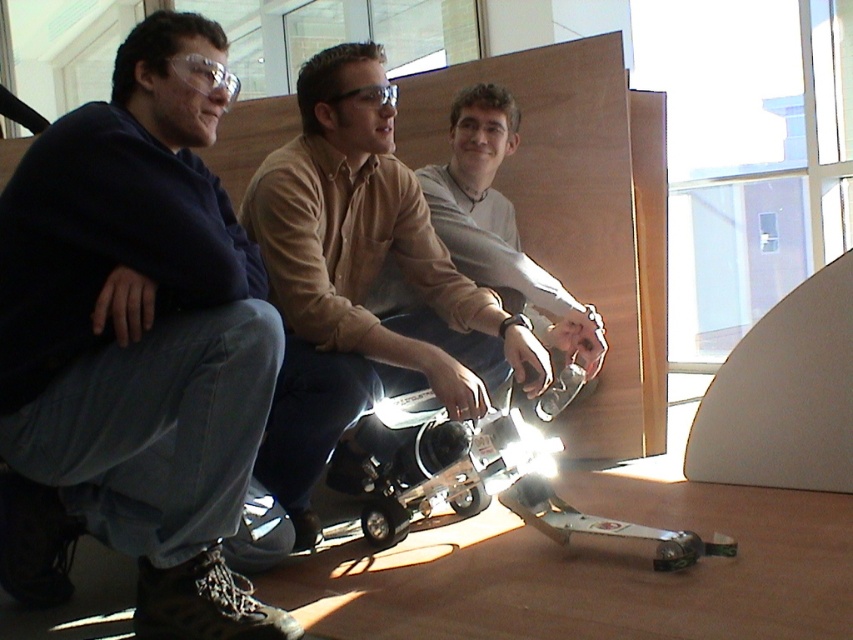
Is matte brown shirt at center shorter than metallic silver drone at center?

In fact, matte brown shirt at center may be taller than metallic silver drone at center.

Is matte brown shirt at center positioned in front of metallic silver drone at center?

No, matte brown shirt at center is further to the viewer.

Where is `matte brown shirt at center`? matte brown shirt at center is located at coordinates (361, 280).

Is metallic silver drone at center behind light gray shirt at center?

No.

Does metallic silver drone at center have a greater width compared to light gray shirt at center?

Indeed, metallic silver drone at center has a greater width compared to light gray shirt at center.

Is point (495, 396) positioned behind point (486, 237)?

No, it is not.

This screenshot has width=853, height=640. I want to click on metallic silver drone at center, so [x=483, y=476].

Between matte black jacket at left and light gray shirt at center, which one appears on the left side from the viewer's perspective?

From the viewer's perspective, matte black jacket at left appears more on the left side.

Is the position of matte black jacket at left more distant than that of light gray shirt at center?

No, it is in front of light gray shirt at center.

This screenshot has width=853, height=640. I want to click on matte black jacket at left, so click(x=142, y=332).